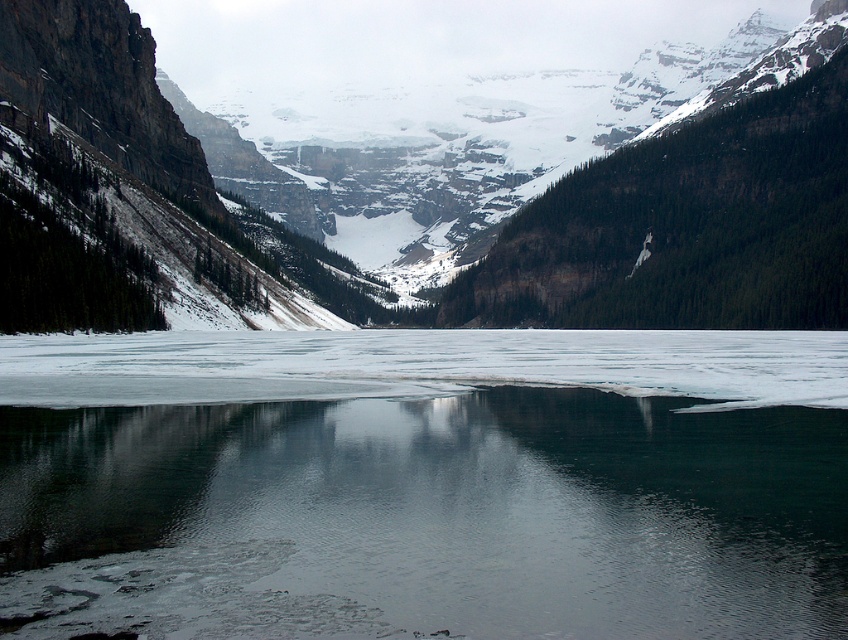
Question: Observing the image, what is the correct spatial positioning of clear ice at center in reference to snowy rock mountain at center?

Choices:
 (A) right
 (B) left

Answer: (A)

Question: In this image, where is clear ice at center located relative to snowy rock mountain at center?

Choices:
 (A) below
 (B) above

Answer: (A)

Question: Which point is closer to the camera?

Choices:
 (A) clear ice at center
 (B) snowy rock mountain at center

Answer: (A)

Question: Which object is closer to the camera taking this photo?

Choices:
 (A) clear ice at center
 (B) snowy rock mountain at center

Answer: (A)

Question: Can you confirm if clear ice at center is bigger than snowy rock mountain at center?

Choices:
 (A) yes
 (B) no

Answer: (B)

Question: Which point is closer to the camera taking this photo?

Choices:
 (A) (718, 474)
 (B) (212, 209)

Answer: (A)